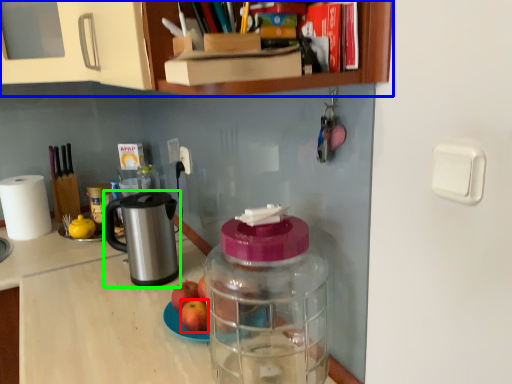
Question: Which object is positioned closest to apple (highlighted by a red box)? Select from cabinetry (highlighted by a blue box) and appliance (highlighted by a green box).

Choices:
 (A) cabinetry
 (B) appliance

Answer: (B)